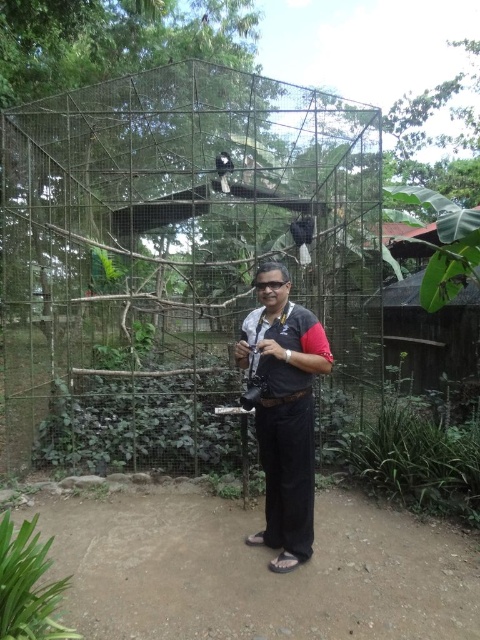
Can you confirm if metal mesh cage at center is shorter than black fabric shirt at center?

In fact, metal mesh cage at center may be taller than black fabric shirt at center.

Who is positioned more to the right, metal mesh cage at center or black fabric shirt at center?

From the viewer's perspective, black fabric shirt at center appears more on the right side.

Between point (60, 288) and point (283, 548), which one is positioned in front?

Point (283, 548)

Identify the location of metal mesh cage at center. (176, 259).